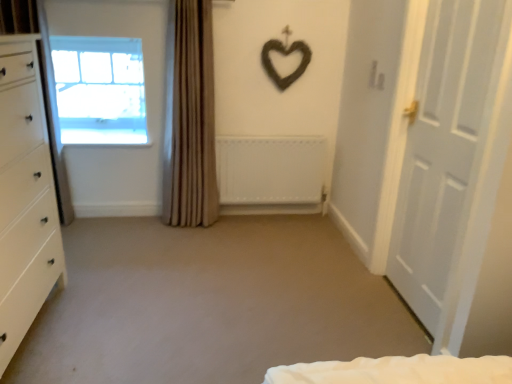
The image size is (512, 384). What do you see at coordinates (190, 118) in the screenshot?
I see `beige fabric curtain at center` at bounding box center [190, 118].

The image size is (512, 384). Identify the location of white matte door at right. (459, 182).

Is white glossy chest of drawers at left not close to beige fabric curtain at center?

Yes.

Based on the photo, from the image's perspective, which one is positioned higher, white glossy chest of drawers at left or beige fabric curtain at center?

beige fabric curtain at center appears higher in the image.

Considering the positions of objects white glossy chest of drawers at left and beige fabric curtain at center in the image provided, who is more to the left, white glossy chest of drawers at left or beige fabric curtain at center?

white glossy chest of drawers at left is more to the left.

From a real-world perspective, which object stands above the other?

A: From a 3D spatial view, beige fabric curtain at center is above.

Is white matte door at right facing towards transparent glass window at upper left?

No, white matte door at right is not facing towards transparent glass window at upper left.

From a real-world perspective, is white matte door at right on top of transparent glass window at upper left?

No.

Relative to transparent glass window at upper left, is white matte door at right in front or behind?

In the image, white matte door at right appears in front of transparent glass window at upper left.

Is transparent glass window at upper left in front of white matte door at right?

No, the depth of transparent glass window at upper left is greater than that of white matte door at right.

Does point (108, 70) lie in front of point (474, 109)?

No, it is not.

Based on the photo, is transparent glass window at upper left looking in the opposite direction of white matte door at right?

No, transparent glass window at upper left's orientation is not away from white matte door at right.

From the image's perspective, is transparent glass window at upper left located above or below white matte radiator at center?

transparent glass window at upper left is above white matte radiator at center.

Is the position of transparent glass window at upper left less distant than that of white matte radiator at center?

That is False.

Considering the sizes of objects transparent glass window at upper left and white matte radiator at center in the image provided, who is wider, transparent glass window at upper left or white matte radiator at center?

Wider between the two is transparent glass window at upper left.

Can you see white glossy chest of drawers at left touching transparent glass window at upper left?

white glossy chest of drawers at left and transparent glass window at upper left are clearly separated.

Considering the sizes of white glossy chest of drawers at left and transparent glass window at upper left in the image, is white glossy chest of drawers at left taller or shorter than transparent glass window at upper left?

In the image, white glossy chest of drawers at left appears to be taller than transparent glass window at upper left.

From a real-world perspective, is white glossy chest of drawers at left positioned above or below transparent glass window at upper left?

In terms of real-world spatial position, white glossy chest of drawers at left is below transparent glass window at upper left.

Would you say transparent glass window at upper left is part of white glossy chest of drawers at left's contents?

Definitely not — transparent glass window at upper left is not inside white glossy chest of drawers at left.

The image size is (512, 384). Find the location of `curtain that appears below the transparent glass window at upper left (from a real-world perspective)`. curtain that appears below the transparent glass window at upper left (from a real-world perspective) is located at coordinates (190, 118).

In the scene shown: Which object is more forward, transparent glass window at upper left or beige fabric curtain at center?

Positioned in front is beige fabric curtain at center.

Which of these two, transparent glass window at upper left or beige fabric curtain at center, is thinner?

transparent glass window at upper left is thinner.

Is point (198, 106) positioned after point (119, 81)?

No, (198, 106) is closer to viewer.

From a real-world perspective, which object rests below the other?

In real-world perspective, beige fabric curtain at center is lower.

Is beige fabric curtain at center next to transparent glass window at upper left?

No, beige fabric curtain at center is not with transparent glass window at upper left.

Measure the distance from beige fabric curtain at center to transparent glass window at upper left.

A distance of 20.44 inches exists between beige fabric curtain at center and transparent glass window at upper left.

The width and height of the screenshot is (512, 384). What are the coordinates of `curtain positioned vertically above the white glossy chest of drawers at left (from a real-world perspective)` in the screenshot? It's located at (190, 118).

Where is `window above the white matte door at right (from the image's perspective)`? The height and width of the screenshot is (384, 512). window above the white matte door at right (from the image's perspective) is located at coordinates (100, 90).

Based on their spatial positions, is white matte radiator at center or beige fabric curtain at center closer to transparent glass window at upper left?

The object closer to transparent glass window at upper left is beige fabric curtain at center.

Considering their positions, is beige fabric curtain at center positioned closer to white matte door at right than white matte radiator at center?

white matte radiator at center lies closer to white matte door at right than the other object.

Estimate the real-world distances between objects in this image. Which object is further from transparent glass window at upper left, beige fabric curtain at center or white matte radiator at center?

white matte radiator at center is positioned further to the anchor transparent glass window at upper left.

Looking at the image, which one is located closer to white matte radiator at center, white matte door at right or transparent glass window at upper left?

transparent glass window at upper left.

Which object lies nearer to the anchor point white glossy chest of drawers at left, white matte radiator at center or beige fabric curtain at center?

The object closer to white glossy chest of drawers at left is beige fabric curtain at center.

Based on the photo, which object lies further to the anchor point transparent glass window at upper left, white glossy chest of drawers at left or beige fabric curtain at center?

white glossy chest of drawers at left is further to transparent glass window at upper left.

Considering their positions, is white matte door at right positioned further to transparent glass window at upper left than white matte radiator at center?

white matte door at right lies further to transparent glass window at upper left than the other object.

When comparing their distances from white matte radiator at center, does white glossy chest of drawers at left or white matte door at right seem closer?

Among the two, white matte door at right is located nearer to white matte radiator at center.

In order to click on curtain between white glossy chest of drawers at left and transparent glass window at upper left from front to back in this screenshot , I will do `click(190, 118)`.

Where is `curtain between white glossy chest of drawers at left and white matte radiator at center from front to back`? This screenshot has height=384, width=512. curtain between white glossy chest of drawers at left and white matte radiator at center from front to back is located at coordinates (190, 118).

The width and height of the screenshot is (512, 384). I want to click on curtain between transparent glass window at upper left and white matte radiator at center in the horizontal direction, so click(190, 118).

The height and width of the screenshot is (384, 512). Identify the location of curtain located between white glossy chest of drawers at left and white matte door at right in the left-right direction. (190, 118).